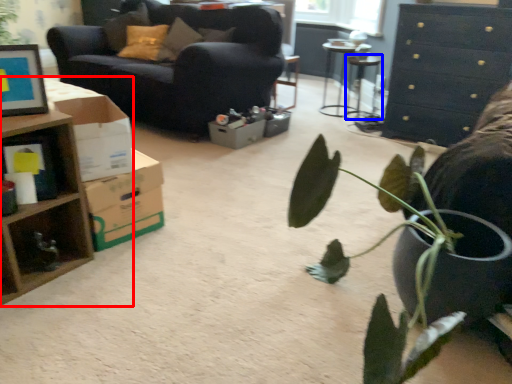
Question: Which point is further to the camera, desk (highlighted by a red box) or table (highlighted by a blue box)?

Choices:
 (A) desk
 (B) table

Answer: (B)